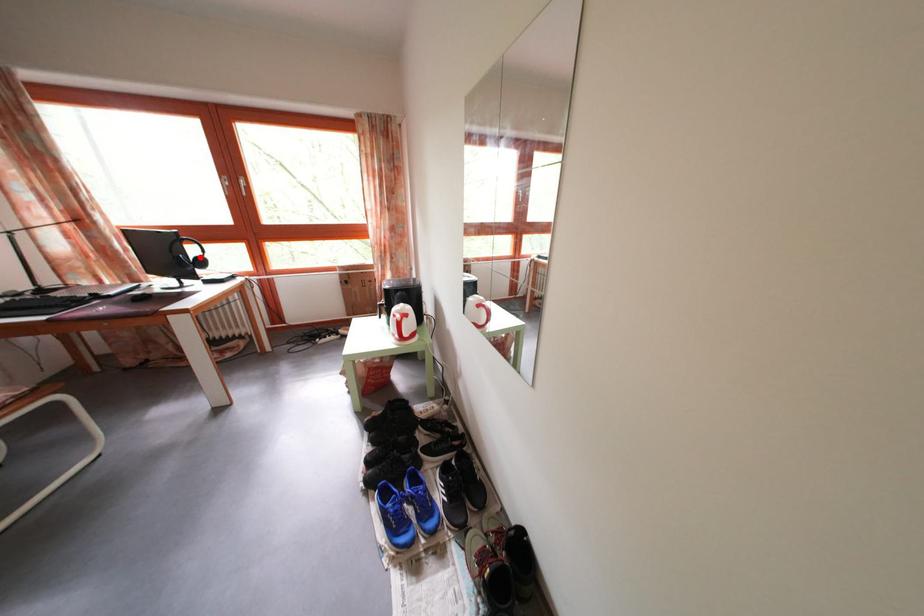
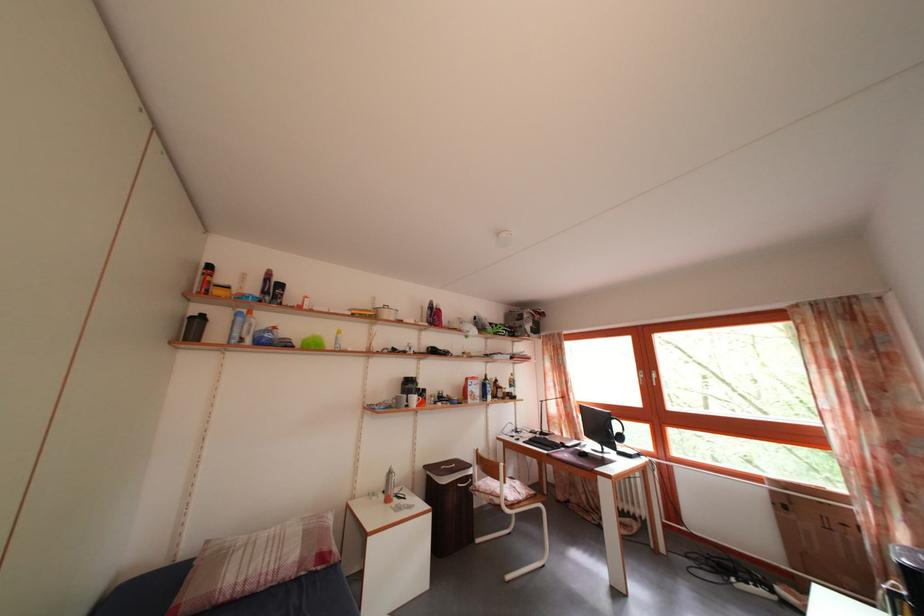
Question: A red point is marked in image1. In image2, is the corresponding 3D point closer to the camera or farther? Reply with the corresponding letter.

Choices:
 (A) The corresponding 3D point is closer.
 (B) The corresponding 3D point is farther.

Answer: (B)